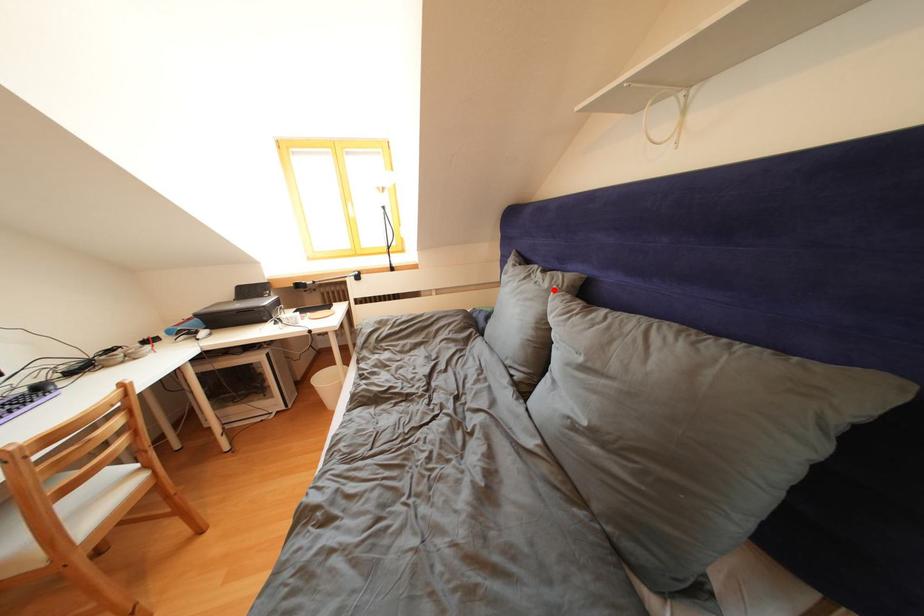
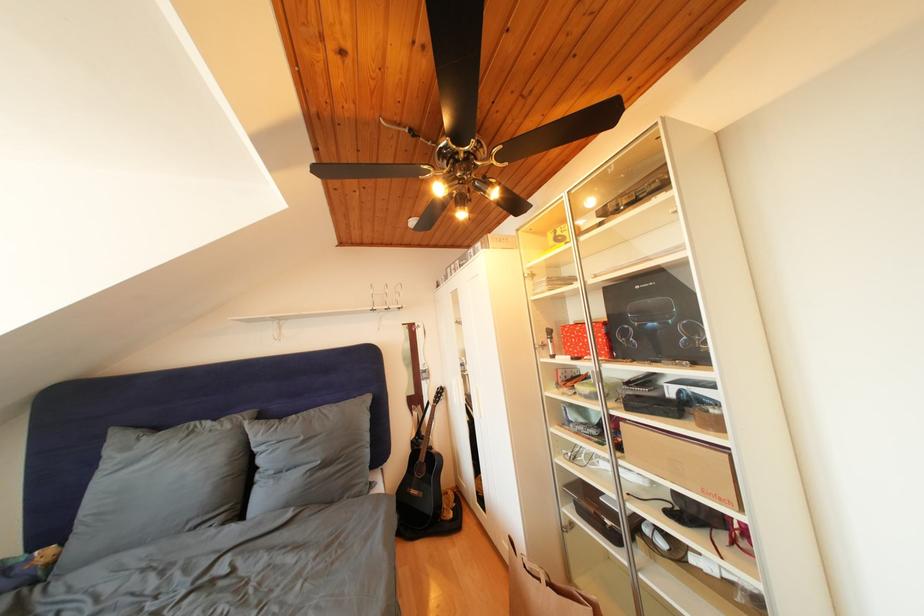
Locate, in the second image, the point that corresponds to the highlighted location in the first image.

(236, 432)